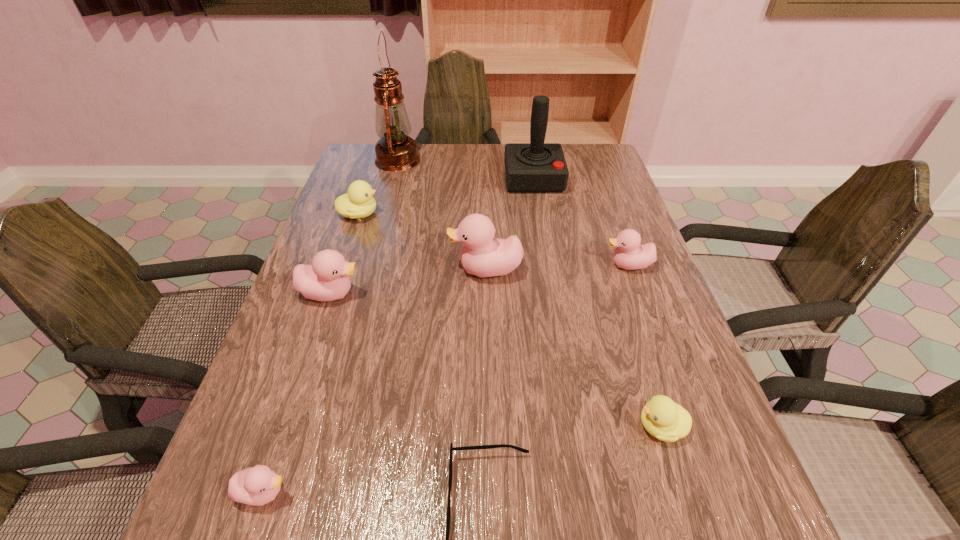
Locate an element on the screen. the tallest object is located at coordinates (395, 151).

I want to click on the eighth shortest object, so click(x=536, y=167).

You are a GUI agent. You are given a task and a screenshot of the screen. Output one action in this format:
    pyautogui.click(x=<x>, y=<y>)
    Task: Click on the joystick
    The image size is (960, 540).
    Given the screenshot: What is the action you would take?
    pyautogui.click(x=536, y=167)

I want to click on the third tallest object, so click(482, 255).

Locate an element on the screen. the third duckling from right to left is located at coordinates (482, 255).

Locate an element on the screen. The height and width of the screenshot is (540, 960). the second biggest pink duckling is located at coordinates [x=327, y=279].

Locate an element on the screen. This screenshot has height=540, width=960. the fourth tallest object is located at coordinates (327, 279).

Find the location of a particular element. the farther yellow duckling is located at coordinates (358, 202).

Image resolution: width=960 pixels, height=540 pixels. I want to click on the seventh nearest object, so click(x=358, y=202).

This screenshot has height=540, width=960. I want to click on the rightmost pink duckling, so click(629, 255).